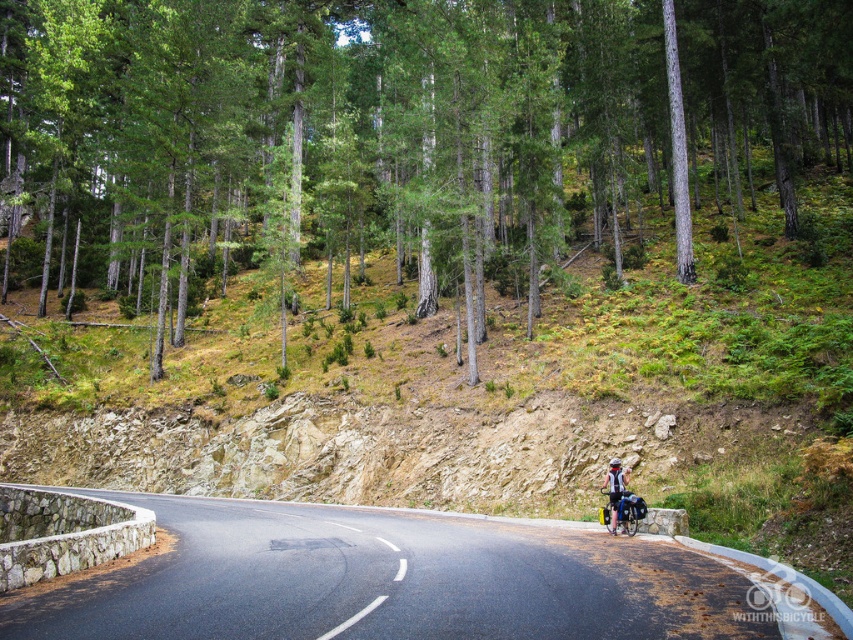
From the picture: You are a cyclist planning to take a break on the road. The road curves gently to the left and is bordered by a low stone wall on the left and a grassy embankment on the right. You see a point marked at coordinates (405, 580). According to the image, where is this point located?

The point at coordinates (405, 580) is located on the black asphalt road at center.